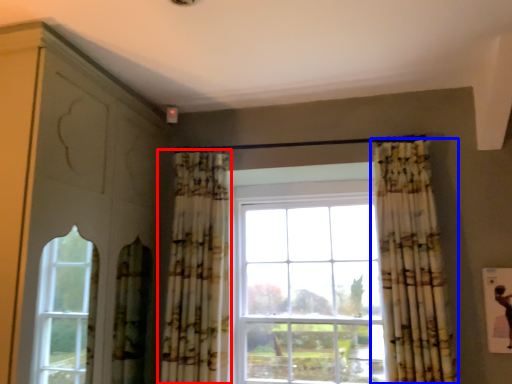
Question: Which of the following is the farthest to the observer, curtain (highlighted by a red box) or curtain (highlighted by a blue box)?

Choices:
 (A) curtain
 (B) curtain

Answer: (A)